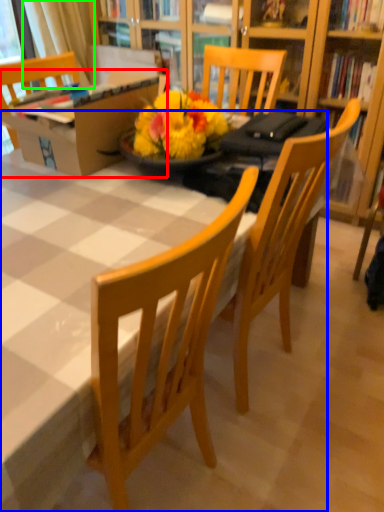
Question: Which object is the farthest from box (highlighted by a red box)? Choose among these: desk (highlighted by a blue box) or curtain (highlighted by a green box).

Choices:
 (A) desk
 (B) curtain

Answer: (B)